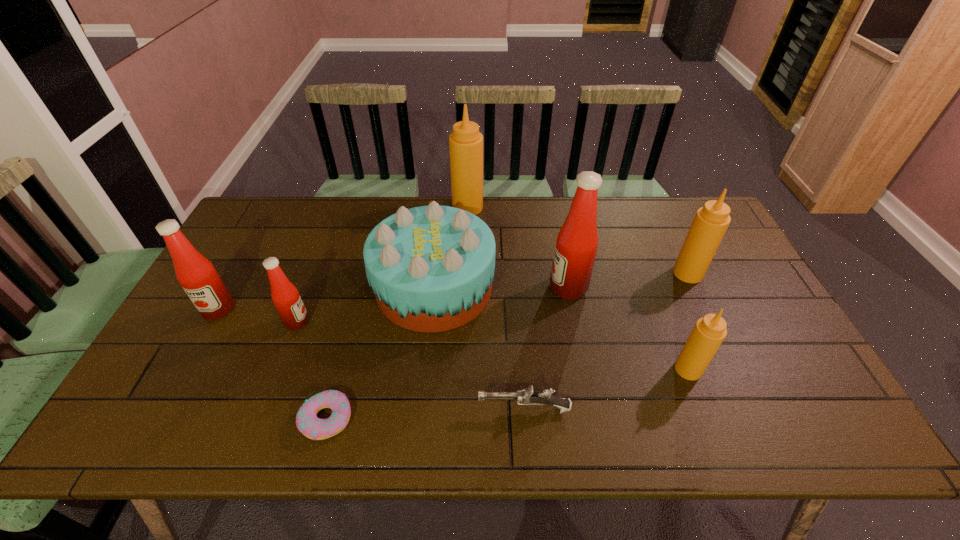
Locate an element on the screen. condiment that stands as the third closest to the doughnut is located at coordinates [576, 246].

Find the location of `condiment that can be found as the closest to the second smallest red condiment`. condiment that can be found as the closest to the second smallest red condiment is located at coordinates (285, 296).

Where is `tan condiment that can be found as the second closest to the cake`? Image resolution: width=960 pixels, height=540 pixels. tan condiment that can be found as the second closest to the cake is located at coordinates (709, 331).

Locate an element on the screen. This screenshot has width=960, height=540. tan condiment that stands as the closest to the eighth tallest object is located at coordinates (709, 331).

This screenshot has width=960, height=540. What are the coordinates of `red condiment that is the second closest to the rightmost object` in the screenshot? It's located at (285, 296).

Find the location of a particular element. The width and height of the screenshot is (960, 540). red condiment that is the second closest one to the cake is located at coordinates (576, 246).

At what (x,y) coordinates should I click in order to perform the action: click on vacant area in the image that satisfies the following two spatial constraints: 1. on the front-facing side of the second condiment from left to right; 2. on the back side of the doughnut. Please return your answer as a coordinate pair (x, y). The height and width of the screenshot is (540, 960). Looking at the image, I should click on (261, 418).

Identify the location of vacant space that satisfies the following two spatial constraints: 1. on the back side of the nearest tan condiment; 2. on the front-facing side of the rightmost red condiment. This screenshot has width=960, height=540. (657, 288).

Locate an element on the screen. The width and height of the screenshot is (960, 540). free region that satisfies the following two spatial constraints: 1. on the front-facing side of the biggest red condiment; 2. on the back side of the nearest condiment is located at coordinates (584, 369).

Identify the location of vacant point that satisfies the following two spatial constraints: 1. on the front side of the rightmost tan condiment; 2. on the front-facing side of the fifth condiment from right to left. The height and width of the screenshot is (540, 960). (711, 322).